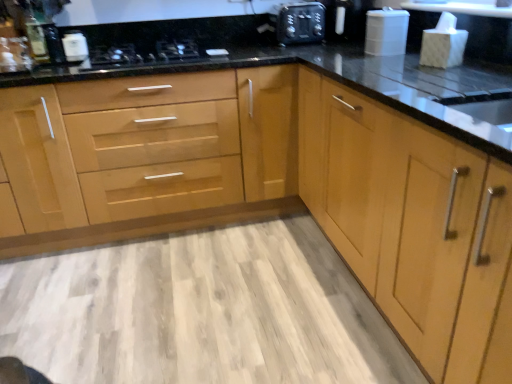
Image resolution: width=512 pixels, height=384 pixels. Identify the location of light wood cabinet at center, which ranks as the second cabinetry in right-to-left order. (170, 156).

Describe the element at coordinates (170, 156) in the screenshot. Image resolution: width=512 pixels, height=384 pixels. I see `light wood cabinet at center, which ranks as the second cabinetry in right-to-left order` at that location.

What do you see at coordinates (301, 24) in the screenshot?
I see `black plastic camera at upper center, acting as the second appliance starting from the left` at bounding box center [301, 24].

You are a GUI agent. You are given a task and a screenshot of the screen. Output one action in this format:
    pyautogui.click(x=<x>, y=<y>)
    Task: Click on the light wood cabinet at center, which ranks as the second cabinetry in right-to-left order
    The image size is (512, 384).
    Given the screenshot: What is the action you would take?
    pyautogui.click(x=170, y=156)

Can you see light wood cabinet at center, which ranks as the second cabinetry in right-to-left order, touching black glass stove at upper center?

No, light wood cabinet at center, which ranks as the second cabinetry in right-to-left order, is not beside black glass stove at upper center.

Is black glass stove at upper center at the back of light wood cabinet at center, arranged as the first cabinetry when viewed from the left?

Yes, black glass stove at upper center is at the back of light wood cabinet at center, arranged as the first cabinetry when viewed from the left.

Which point is more forward, (64, 154) or (136, 63)?

Positioned in front is point (64, 154).

Is light wood cabinet at center, which ranks as the second cabinetry in right-to-left order, inside the boundaries of black glass stove at upper center, or outside?

light wood cabinet at center, which ranks as the second cabinetry in right-to-left order, exists outside the volume of black glass stove at upper center.

Is the position of black glass stove at upper center less distant than that of light wood cabinet at right, the first cabinetry viewed from the right?

No, it is behind light wood cabinet at right, the first cabinetry viewed from the right.

Is light wood cabinet at right, which appears as the 2th cabinetry when viewed from the left, completely or partially inside black glass stove at upper center?

No.

From a real-world perspective, is black glass stove at upper center under light wood cabinet at right, the first cabinetry viewed from the right?

No, from a real-world perspective, black glass stove at upper center is not beneath light wood cabinet at right, the first cabinetry viewed from the right.

Does point (117, 55) appear closer or farther from the camera than point (386, 199)?

Point (117, 55) appears to be farther away from the viewer than point (386, 199).

How much distance is there between white glossy container at upper left, arranged as the 1th appliance when viewed from the left, and matte black sink at right?

white glossy container at upper left, arranged as the 1th appliance when viewed from the left, is 6.18 feet away from matte black sink at right.

Is white glossy container at upper left, arranged as the second appliance when viewed from the right, taller or shorter than matte black sink at right?

Clearly, white glossy container at upper left, arranged as the second appliance when viewed from the right, is shorter compared to matte black sink at right.

Considering the points (78, 42) and (509, 111), which point is in front, point (78, 42) or point (509, 111)?

Point (509, 111)

Locate an element on the screen. sink below the white glossy container at upper left, arranged as the second appliance when viewed from the right (from a real-world perspective) is located at coordinates (482, 114).

Is light wood cabinet at center, which ranks as the second cabinetry in right-to-left order, taller or shorter than light wood cabinet at right, the first cabinetry viewed from the right?

In the image, light wood cabinet at center, which ranks as the second cabinetry in right-to-left order, appears to be taller than light wood cabinet at right, the first cabinetry viewed from the right.

Which point is more forward, (x=109, y=201) or (x=457, y=340)?

The point (x=457, y=340) is more forward.

From a real-world perspective, does light wood cabinet at center, which ranks as the second cabinetry in right-to-left order, stand above light wood cabinet at right, which appears as the 2th cabinetry when viewed from the left?

No, from a real-world perspective, light wood cabinet at center, which ranks as the second cabinetry in right-to-left order, is not over light wood cabinet at right, which appears as the 2th cabinetry when viewed from the left

Can you confirm if light wood cabinet at center, which ranks as the second cabinetry in right-to-left order, is shorter than matte black sink at right?

In fact, light wood cabinet at center, which ranks as the second cabinetry in right-to-left order, may be taller than matte black sink at right.

Based on their sizes in the image, would you say light wood cabinet at center, arranged as the first cabinetry when viewed from the left, is bigger or smaller than matte black sink at right?

Clearly, light wood cabinet at center, arranged as the first cabinetry when viewed from the left, is larger in size than matte black sink at right.

Between light wood cabinet at center, which ranks as the second cabinetry in right-to-left order, and matte black sink at right, which one has smaller width?

With smaller width is matte black sink at right.

Considering the sizes of objects matte silver faucet at upper left and light wood cabinet at center, arranged as the first cabinetry when viewed from the left, in the image provided, who is wider, matte silver faucet at upper left or light wood cabinet at center, arranged as the first cabinetry when viewed from the left,?

With larger width is light wood cabinet at center, arranged as the first cabinetry when viewed from the left.

Considering the sizes of matte silver faucet at upper left and light wood cabinet at center, arranged as the first cabinetry when viewed from the left, in the image, is matte silver faucet at upper left taller or shorter than light wood cabinet at center, arranged as the first cabinetry when viewed from the left,?

Clearly, matte silver faucet at upper left is shorter compared to light wood cabinet at center, arranged as the first cabinetry when viewed from the left.

Can you tell me how much matte silver faucet at upper left and light wood cabinet at center, arranged as the first cabinetry when viewed from the left, differ in facing direction?

0.355 degrees.

Between black glass stove at upper center and matte silver faucet at upper left, which one has more height?

Standing taller between the two is matte silver faucet at upper left.

Considering the relative positions of black glass stove at upper center and matte silver faucet at upper left in the image provided, is black glass stove at upper center to the left or to the right of matte silver faucet at upper left?

Clearly, black glass stove at upper center is on the right of matte silver faucet at upper left in the image.

Is black glass stove at upper center situated inside matte silver faucet at upper left or outside?

Answer: The correct answer is: outside.

Can you tell me how much black glass stove at upper center and matte silver faucet at upper left differ in facing direction?

black glass stove at upper center and matte silver faucet at upper left are facing 0.000933 degrees away from each other.

Identify the location of the 1st cabinetry to the right of the black glass stove at upper center, counting from the anchor's position. (170, 156).

At what (x,y) coordinates should I click in order to perform the action: click on cabinetry that is the 2nd object located in front of the black glass stove at upper center. Please return your answer as a coordinate pair (x, y). Looking at the image, I should click on (407, 220).

Estimate the real-world distances between objects in this image. Which object is closer to black plastic camera at upper center, acting as the second appliance starting from the left, black glass stove at upper center or matte black sink at right?

Based on the image, black glass stove at upper center appears to be nearer to black plastic camera at upper center, acting as the second appliance starting from the left.

Which object lies further to the anchor point white glossy container at upper left, arranged as the 1th appliance when viewed from the left, matte black sink at right or light wood cabinet at center, which ranks as the second cabinetry in right-to-left order?

matte black sink at right is positioned further to the anchor white glossy container at upper left, arranged as the 1th appliance when viewed from the left.

Which object lies nearer to the anchor point light wood cabinet at right, which appears as the 2th cabinetry when viewed from the left, black glass stove at upper center or matte silver faucet at upper left?

black glass stove at upper center.

Looking at the image, which one is located closer to black glass stove at upper center, black plastic camera at upper center, acting as the second appliance starting from the left, or matte silver faucet at upper left?

matte silver faucet at upper left is closer to black glass stove at upper center.

Estimate the real-world distances between objects in this image. Which object is closer to white glossy container at upper left, arranged as the 1th appliance when viewed from the left, matte black sink at right or matte silver faucet at upper left?

matte silver faucet at upper left is positioned closer to the anchor white glossy container at upper left, arranged as the 1th appliance when viewed from the left.

Considering their positions, is black plastic camera at upper center, the first appliance from the right, positioned further to light wood cabinet at center, arranged as the first cabinetry when viewed from the left, than black glass stove at upper center?

Based on the image, black plastic camera at upper center, the first appliance from the right, appears to be further to light wood cabinet at center, arranged as the first cabinetry when viewed from the left.

When comparing their distances from matte black sink at right, does white glossy container at upper left, arranged as the 1th appliance when viewed from the left, or light wood cabinet at center, arranged as the first cabinetry when viewed from the left, seem further?

white glossy container at upper left, arranged as the 1th appliance when viewed from the left, is further to matte black sink at right.

Based on their spatial positions, is white glossy container at upper left, arranged as the second appliance when viewed from the right, or matte black sink at right closer to light wood cabinet at center, which ranks as the second cabinetry in right-to-left order?

Among the two, white glossy container at upper left, arranged as the second appliance when viewed from the right, is located nearer to light wood cabinet at center, which ranks as the second cabinetry in right-to-left order.

This screenshot has width=512, height=384. Identify the location of cabinetry located between matte black sink at right and black plastic camera at upper center, the first appliance from the right, in the depth direction. (170, 156).

This screenshot has width=512, height=384. Identify the location of cabinetry situated between white glossy container at upper left, arranged as the second appliance when viewed from the right, and black plastic camera at upper center, the first appliance from the right, from left to right. (170, 156).

You are a GUI agent. You are given a task and a screenshot of the screen. Output one action in this format:
    pyautogui.click(x=<x>, y=<y>)
    Task: Click on the stove located between white glossy container at upper left, arranged as the 1th appliance when viewed from the left, and matte black sink at right in the left-right direction
    The width and height of the screenshot is (512, 384).
    Given the screenshot: What is the action you would take?
    pyautogui.click(x=142, y=55)

At what (x,y) coordinates should I click in order to perform the action: click on stove between white glossy container at upper left, arranged as the 1th appliance when viewed from the left, and light wood cabinet at center, which ranks as the second cabinetry in right-to-left order. Please return your answer as a coordinate pair (x, y). The image size is (512, 384). Looking at the image, I should click on (142, 55).